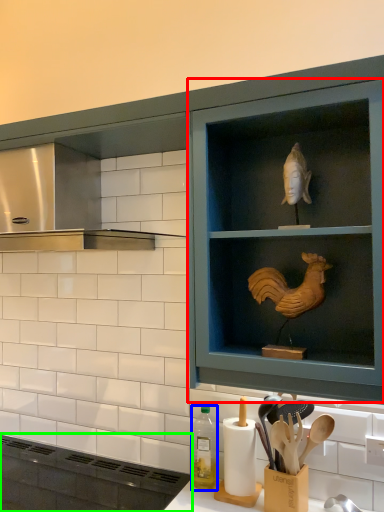
Question: Estimate the real-world distances between objects in this image. Which object is closer to shelf (highlighted by a red box), bottle (highlighted by a blue box) or appliance (highlighted by a green box)?

Choices:
 (A) bottle
 (B) appliance

Answer: (A)